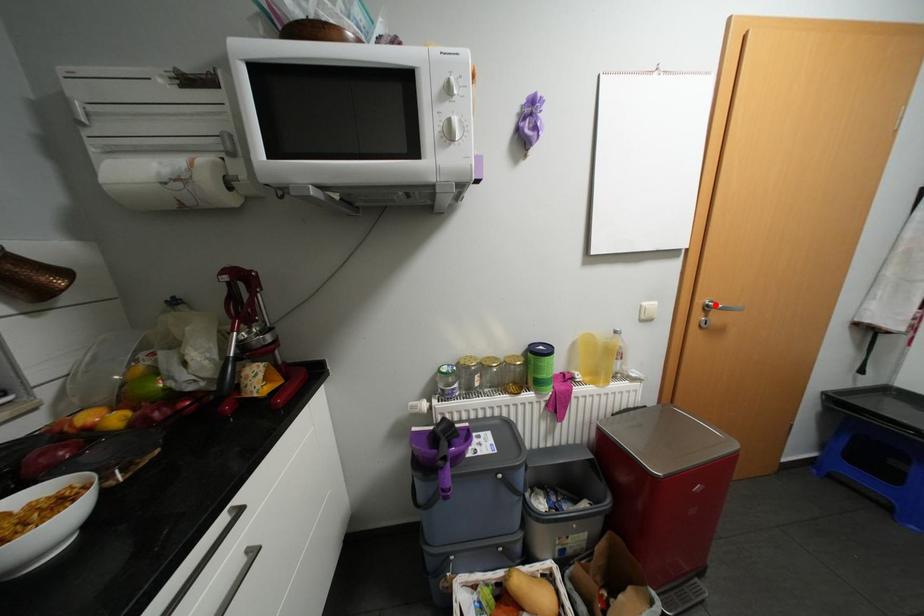
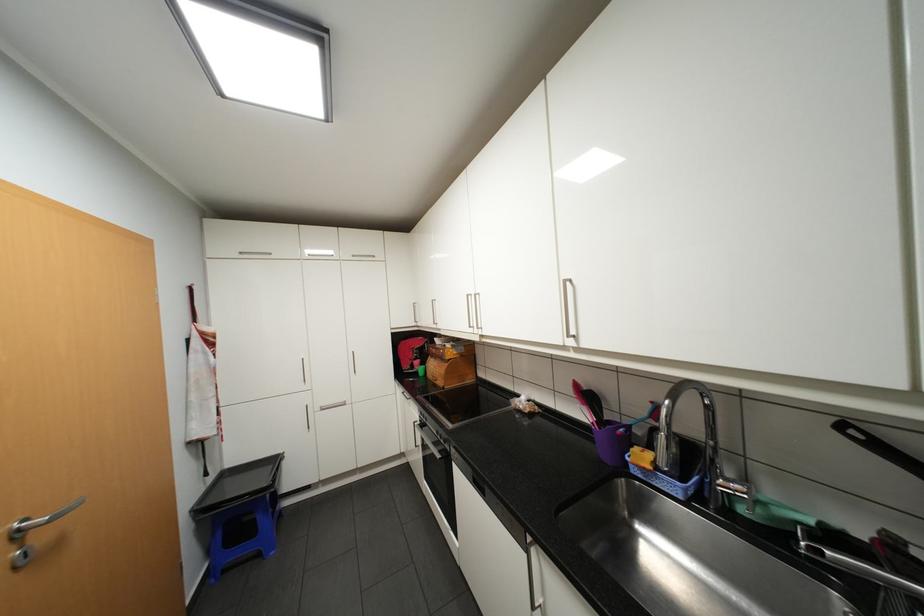
The point at the highlighted location is marked in the first image. Where is the corresponding point in the second image?

(27, 530)